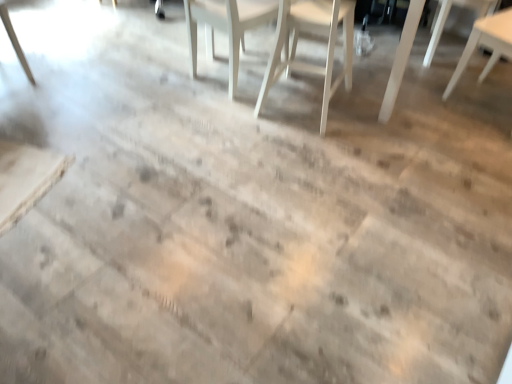
Image resolution: width=512 pixels, height=384 pixels. Identify the location of free space in front of white wood chair at center, the first chair when ordered from left to right. (221, 119).